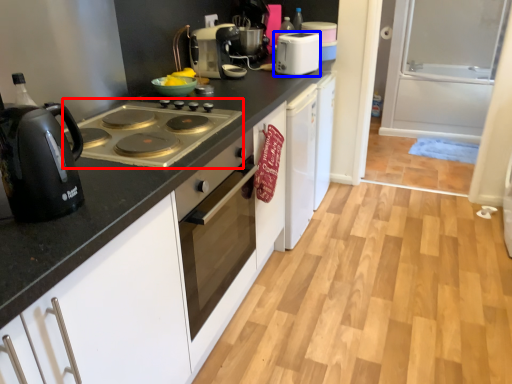
Question: Which object appears closest to the camera in this image, gas stove (highlighted by a red box) or kitchen appliance (highlighted by a blue box)?

Choices:
 (A) gas stove
 (B) kitchen appliance

Answer: (A)